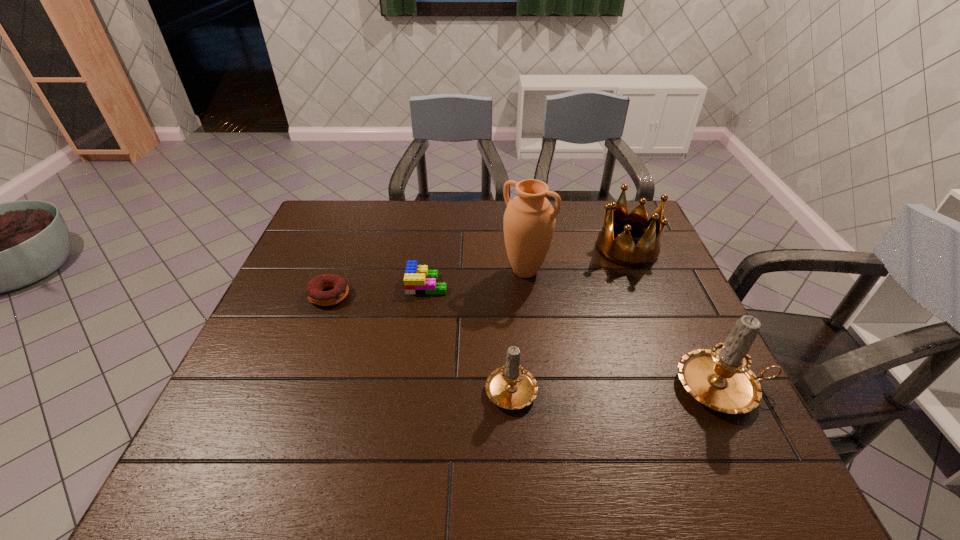
I want to click on vacant space that is in between the right candle and the fourth tallest object, so click(617, 387).

You are a GUI agent. You are given a task and a screenshot of the screen. Output one action in this format:
    pyautogui.click(x=<x>, y=<y>)
    Task: Click on the blank region between the Lego and the left candle
    The height and width of the screenshot is (540, 960).
    Given the screenshot: What is the action you would take?
    pyautogui.click(x=469, y=335)

Where is `free space between the leftmost object and the left candle`? Image resolution: width=960 pixels, height=540 pixels. free space between the leftmost object and the left candle is located at coordinates (420, 341).

Locate an element on the screen. Image resolution: width=960 pixels, height=540 pixels. unoccupied position between the crown and the tallest object is located at coordinates (576, 260).

You are a GUI agent. You are given a task and a screenshot of the screen. Output one action in this format:
    pyautogui.click(x=<x>, y=<y>)
    Task: Click on the vacant area that lies between the second shortest object and the tallest object
    The height and width of the screenshot is (540, 960).
    Given the screenshot: What is the action you would take?
    pyautogui.click(x=476, y=278)

This screenshot has height=540, width=960. I want to click on unoccupied position between the second tallest object and the fourth shortest object, so [675, 318].

Locate an element on the screen. The image size is (960, 540). free area in between the shortest object and the fourth shortest object is located at coordinates (478, 272).

Locate which object is the third closest to the Lego. Please provide its 2D coordinates. Your answer should be formatted as a tuple, i.e. [(x, y)], where the tuple contains the x and y coordinates of a point satisfying the conditions above.

[(512, 387)]

Identify the location of object identified as the fourth closest to the tallest object. (720, 378).

Find the location of a particular element. Image resolution: width=960 pixels, height=540 pixels. blank area in the image that satisfies the following two spatial constraints: 1. on the back side of the fourth tallest object; 2. on the left side of the tallest object is located at coordinates (504, 271).